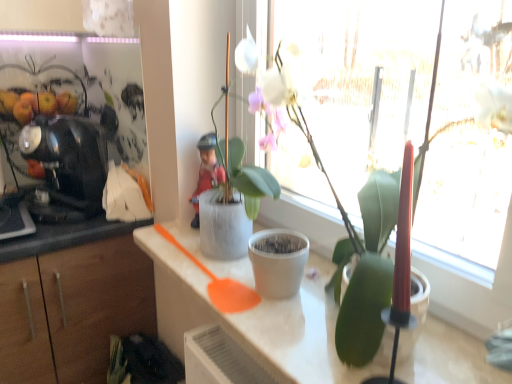
This screenshot has width=512, height=384. Identify the location of free point above white matte countertop at center (from a real-world perspective). (259, 291).